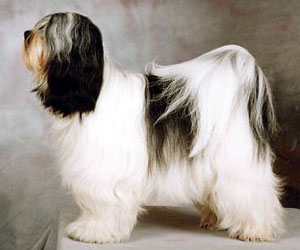
This screenshot has height=250, width=300. I want to click on ledge, so click(x=58, y=227).